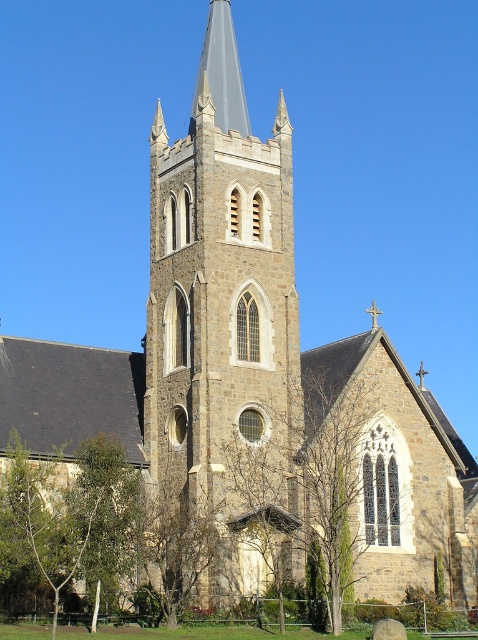
You are standing in front of the church and notice both the brown stone tower at center and the brown textured tree at lower center. Which object is located to the right of the other?

The brown stone tower at center is positioned on the right side of the brown textured tree at lower center.

You are standing in front of the grand stone church and notice two points marked on the facade. The first point is at coordinates point (219,180) and the second is at point (201,68). Which of these two points appears closer to your viewpoint?

Point (219,180) is closer to the camera than point (201,68).